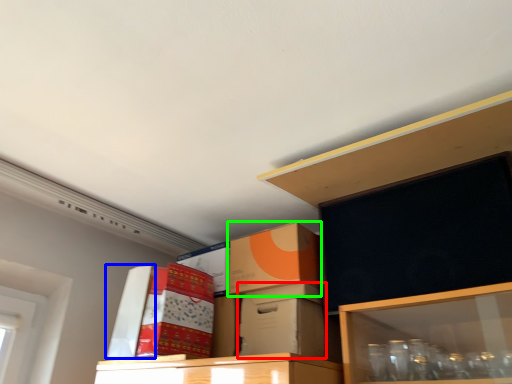
Question: Based on their relative distances, which object is nearer to box (highlighted by a red box)? Choose from box (highlighted by a blue box) and box (highlighted by a green box).

Choices:
 (A) box
 (B) box

Answer: (B)